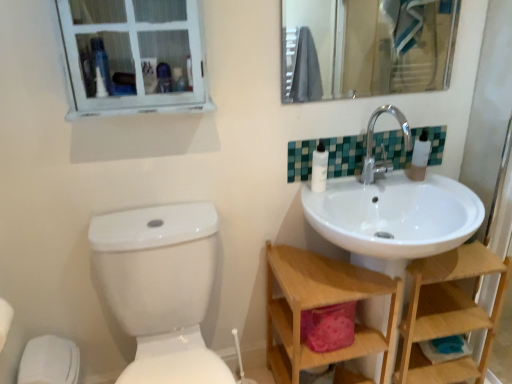
You are a GUI agent. You are given a task and a screenshot of the screen. Output one action in this format:
    pyautogui.click(x=<x>, y=<y>)
    Task: Click on the unoccupied area in front of white plastic bottles at upper right
    
    Given the screenshot: What is the action you would take?
    pyautogui.click(x=439, y=189)